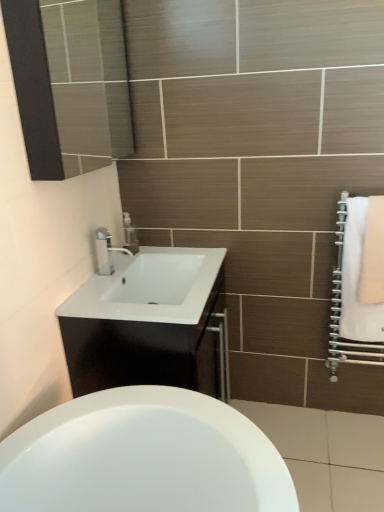
In order to click on free location in front of satin nickel faucet at center in this screenshot , I will do `click(104, 293)`.